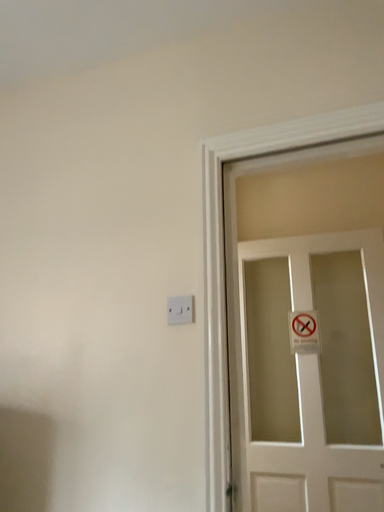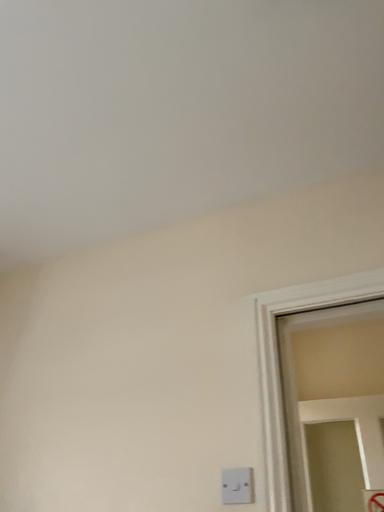
Question: How did the camera likely rotate when shooting the video?

Choices:
 (A) rotated upward
 (B) rotated downward

Answer: (A)